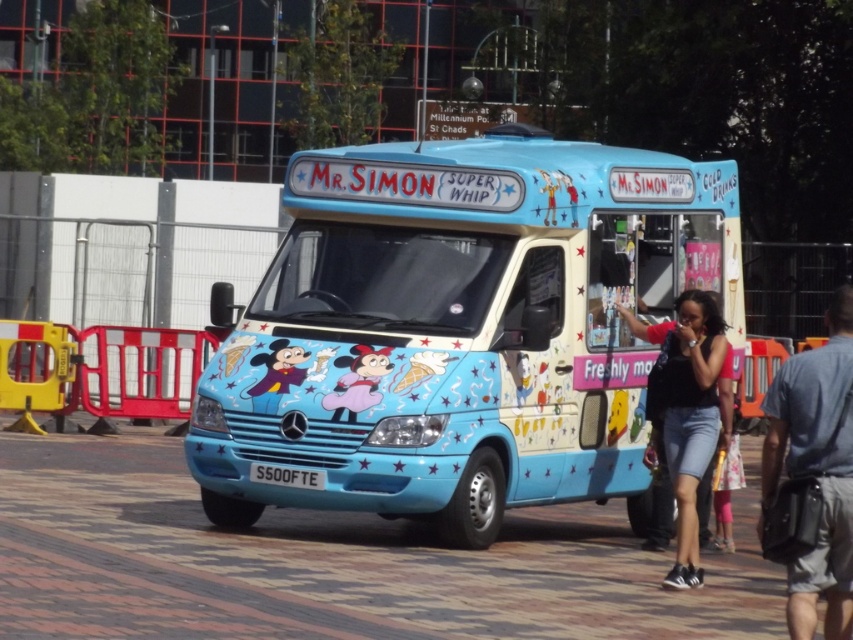
Question: Among these objects, which one is nearest to the camera?

Choices:
 (A) denim shorts at lower right
 (B) black denim shorts at lower right
 (C) brick pavement at lower center

Answer: (A)

Question: Which point is closer to the camera taking this photo?

Choices:
 (A) (461, 502)
 (B) (633, 317)

Answer: (A)

Question: Does denim shorts at lower right come behind black denim shorts at lower right?

Choices:
 (A) yes
 (B) no

Answer: (B)

Question: Which is farther from the denim shorts at lower right?

Choices:
 (A) light blue painted van at center
 (B) black denim shorts at lower right

Answer: (A)

Question: Does light blue painted van at center have a larger size compared to brick pavement at lower center?

Choices:
 (A) no
 (B) yes

Answer: (A)

Question: Is brick pavement at lower center positioned at the back of black denim shorts at lower right?

Choices:
 (A) no
 (B) yes

Answer: (A)